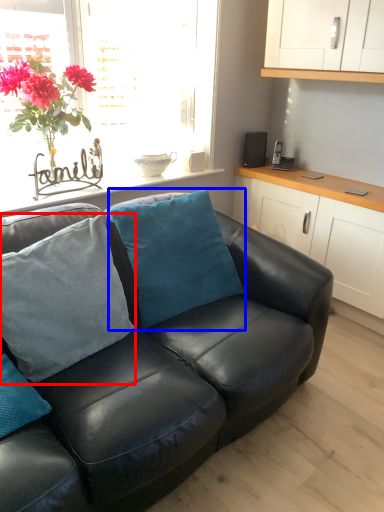
Question: Which object appears farthest to the camera in this image, pillow (highlighted by a red box) or pillow (highlighted by a blue box)?

Choices:
 (A) pillow
 (B) pillow

Answer: (B)